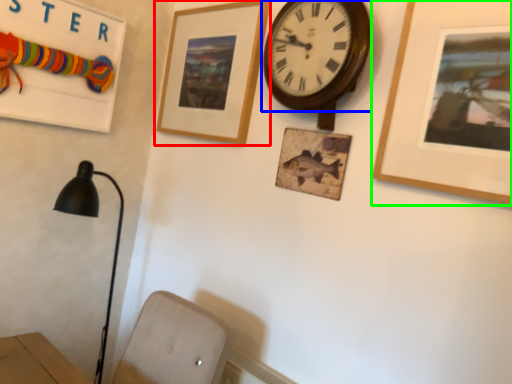
Question: Estimate the real-world distances between objects in this image. Which object is closer to picture frame (highlighted by a red box), wall clock (highlighted by a blue box) or picture frame (highlighted by a green box)?

Choices:
 (A) wall clock
 (B) picture frame

Answer: (A)